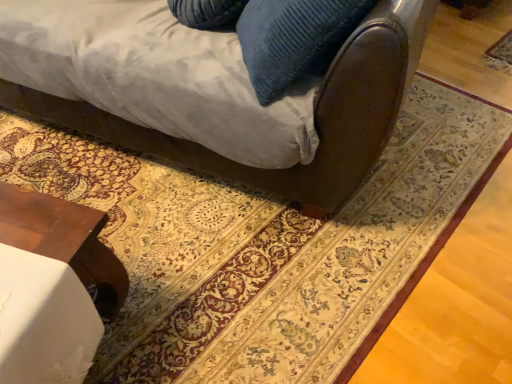
Question: Should I look upward or downward to see brown leather couch at upper center?

Choices:
 (A) up
 (B) down

Answer: (A)